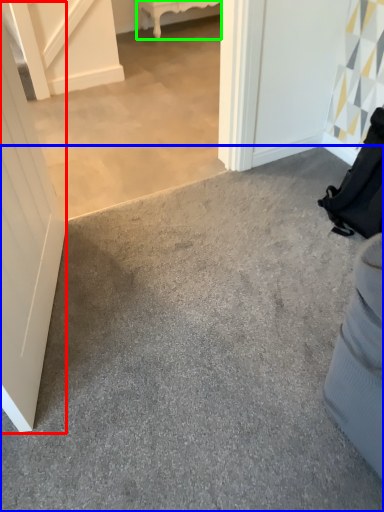
Question: Estimate the real-world distances between objects in this image. Which object is closer to door (highlighted by a red box), concrete (highlighted by a blue box) or furniture (highlighted by a green box)?

Choices:
 (A) concrete
 (B) furniture

Answer: (A)